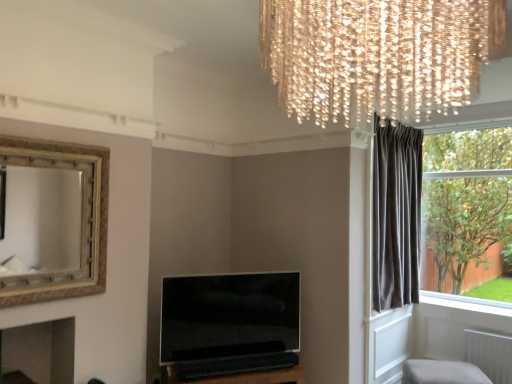
In order to click on free space above gold textured mirror at upper left (from a real-world perspective) in this screenshot , I will do `click(54, 144)`.